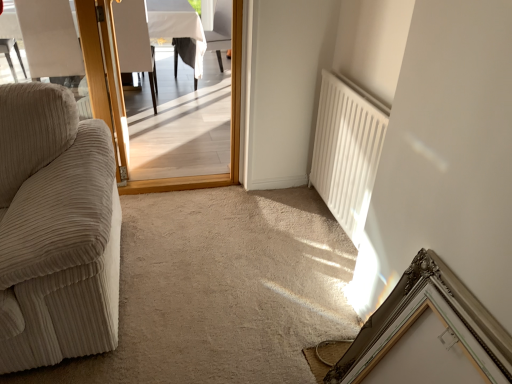
Question: Is wooden screen door at left touching wooden door at center?

Choices:
 (A) no
 (B) yes

Answer: (A)

Question: Does wooden screen door at left come in front of wooden door at center?

Choices:
 (A) yes
 (B) no

Answer: (A)

Question: Can you confirm if wooden screen door at left is thinner than wooden door at center?

Choices:
 (A) no
 (B) yes

Answer: (A)

Question: Does wooden screen door at left appear on the left side of wooden door at center?

Choices:
 (A) no
 (B) yes

Answer: (A)

Question: Is wooden screen door at left positioned with its back to wooden door at center?

Choices:
 (A) no
 (B) yes

Answer: (B)

Question: From the image's perspective, is wooden screen door at left located beneath wooden door at center?

Choices:
 (A) no
 (B) yes

Answer: (B)

Question: From a real-world perspective, is silver ornate picture frame at lower right located beneath white fabric chair at upper center?

Choices:
 (A) no
 (B) yes

Answer: (B)

Question: Is silver ornate picture frame at lower right to the left of white fabric chair at upper center from the viewer's perspective?

Choices:
 (A) yes
 (B) no

Answer: (B)

Question: Is silver ornate picture frame at lower right oriented away from white fabric chair at upper center?

Choices:
 (A) no
 (B) yes

Answer: (A)

Question: Does silver ornate picture frame at lower right lie behind white fabric chair at upper center?

Choices:
 (A) no
 (B) yes

Answer: (A)

Question: Can we say silver ornate picture frame at lower right lies outside white fabric chair at upper center?

Choices:
 (A) yes
 (B) no

Answer: (A)

Question: Can you confirm if silver ornate picture frame at lower right is smaller than white fabric chair at upper center?

Choices:
 (A) no
 (B) yes

Answer: (B)

Question: From the image's perspective, is beige corduroy armchair at left, positioned as the 1th armchair in left-to-right order, beneath white fabric chair at upper center?

Choices:
 (A) yes
 (B) no

Answer: (A)